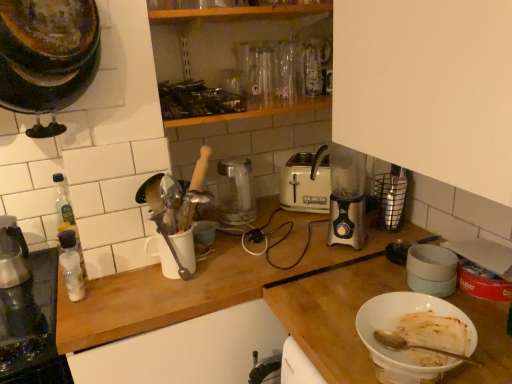
What is the approximate width of white plastic bottle at left, the first bottle from the back?

white plastic bottle at left, the first bottle from the back, is 2.09 inches in width.

Describe the element at coordinates (390, 198) in the screenshot. I see `satin silver blender at right, the first appliance viewed from the right` at that location.

How much space does matte white cup at center, marked as the second bowl in a right-to-left arrangement, occupy horizontally?

matte white cup at center, marked as the second bowl in a right-to-left arrangement, is 4.51 inches in width.

What do you see at coordinates (335, 315) in the screenshot? I see `white matte bowl at lower right, the 2th countertop when ordered from back to front` at bounding box center [335, 315].

Describe the element at coordinates (47, 53) in the screenshot. I see `rusty metal pot at upper left, arranged as the 1th kitchen appliance when viewed from the left` at that location.

Find the location of a particular element. This screenshot has width=512, height=384. rusty metal pot at upper left, arranged as the 1th kitchen appliance when viewed from the left is located at coordinates [47, 53].

What is the approximate height of clear plastic bottle at left, the 1th bottle viewed from the front?

A: It is 5.37 inches.

Find the location of a particular element. satin silver kettle at center, placed as the 1th kitchen appliance when sorted from back to front is located at coordinates (234, 191).

From a real-world perspective, starting from the white plastic toaster at center, which bottle is the 2nd one below it? Please provide its 2D coordinates.

[(71, 265)]

Is white plastic toaster at center positioned behind clear plastic bottle at left, the 1th bottle viewed from the front?

Yes.

In terms of width, does white matte bowl at lower right, the first bowl in the front-to-back sequence, look wider or thinner when compared to matte white cup at center, which appears as the first bowl when viewed from the left?

Considering their sizes, white matte bowl at lower right, the first bowl in the front-to-back sequence, looks slimmer than matte white cup at center, which appears as the first bowl when viewed from the left.

Who is more distant, white matte bowl at lower right, which is counted as the 2th bowl, starting from the back, or matte white cup at center, which appears as the first bowl when viewed from the left?

matte white cup at center, which appears as the first bowl when viewed from the left, is further from the camera.

Based on the photo, which is more to the left, white matte bowl at lower right, the first bowl in the front-to-back sequence, or matte white cup at center, which is counted as the second bowl, starting from the front?

matte white cup at center, which is counted as the second bowl, starting from the front, is more to the left.

From the image's perspective, is white plastic bottle at left, the first bottle from the back, above or below white plastic toaster at center?

Based on their image positions, white plastic bottle at left, the first bottle from the back, is located beneath white plastic toaster at center.

From a real-world perspective, is white plastic bottle at left, the first bottle from the back, physically above white plastic toaster at center?

No, from a real-world perspective, white plastic bottle at left, the first bottle from the back, is not over white plastic toaster at center

Who is smaller, white plastic bottle at left, the first bottle from the back, or white plastic toaster at center?

white plastic bottle at left, the first bottle from the back.

From the image's perspective, is rusty metal pot at upper left, acting as the 1th kitchen appliance starting from the front, on white plastic toaster at center?

Yes, from the image's perspective, rusty metal pot at upper left, acting as the 1th kitchen appliance starting from the front, is on top of white plastic toaster at center.

Which is correct: rusty metal pot at upper left, positioned as the third kitchen appliance in right-to-left order, is inside white plastic toaster at center, or outside of it?

rusty metal pot at upper left, positioned as the third kitchen appliance in right-to-left order, is located beyond the bounds of white plastic toaster at center.

From a real-world perspective, is rusty metal pot at upper left, acting as the 1th kitchen appliance starting from the front, positioned above or below white plastic toaster at center?

From a real-world perspective, rusty metal pot at upper left, acting as the 1th kitchen appliance starting from the front, is physically above white plastic toaster at center.

Are rusty metal pot at upper left, positioned as the third kitchen appliance in right-to-left order, and white plastic toaster at center far apart?

rusty metal pot at upper left, positioned as the third kitchen appliance in right-to-left order, is actually quite close to white plastic toaster at center.

From the image's perspective, between matte white cup at center, which appears as the first bowl when viewed from the left, and white matte bowl at lower right, which is counted as the 2th bowl, starting from the back, who is located below?

From the image's view, white matte bowl at lower right, which is counted as the 2th bowl, starting from the back, is below.

How different are the orientations of matte white cup at center, which is counted as the second bowl, starting from the front, and white matte bowl at lower right, the 2th bowl from the left, in degrees?

The angular difference between matte white cup at center, which is counted as the second bowl, starting from the front, and white matte bowl at lower right, the 2th bowl from the left, is 98.8 degrees.

Can we say matte white cup at center, marked as the second bowl in a right-to-left arrangement, lies outside white matte bowl at lower right, the first bowl in the front-to-back sequence?

Yes, matte white cup at center, marked as the second bowl in a right-to-left arrangement, is not within white matte bowl at lower right, the first bowl in the front-to-back sequence.

Is matte white cup at center, which appears as the first bowl when viewed from the left, positioned far away from white matte bowl at lower right, the 1th bowl positioned from the bottom?

That's not correct — matte white cup at center, which appears as the first bowl when viewed from the left, is a little close to white matte bowl at lower right, the 1th bowl positioned from the bottom.

Is rusty metal pot at upper left, acting as the 3th kitchen appliance starting from the back, facing towards metallic glass carafe at left?

No, rusty metal pot at upper left, acting as the 3th kitchen appliance starting from the back, does not turn towards metallic glass carafe at left.

Is rusty metal pot at upper left, positioned as the third kitchen appliance in right-to-left order, not within metallic glass carafe at left?

Absolutely, rusty metal pot at upper left, positioned as the third kitchen appliance in right-to-left order, is external to metallic glass carafe at left.

Is rusty metal pot at upper left, acting as the 1th kitchen appliance starting from the front, wider than metallic glass carafe at left?

In fact, rusty metal pot at upper left, acting as the 1th kitchen appliance starting from the front, might be narrower than metallic glass carafe at left.

Is satin silver blender at right, which appears as the second appliance when viewed from the left, located outside wooden at center, the second countertop when ordered from front to back?

satin silver blender at right, which appears as the second appliance when viewed from the left, is positioned outside wooden at center, the second countertop when ordered from front to back.

Based on the photo, is satin silver blender at right, the first appliance viewed from the right, facing away from wooden at center, the 1th countertop in the back-to-front sequence?

No.

This screenshot has width=512, height=384. I want to click on the 2nd countertop below when counting from the satin silver blender at right, which appears as the second appliance when viewed from the left (from the image's perspective), so click(x=232, y=305).

From the picture: From the image's perspective, does satin silver blender at right, which appears as the second appliance when viewed from the left, appear higher than wooden at center, the 1th countertop in the back-to-front sequence?

Indeed, from the image's perspective, satin silver blender at right, which appears as the second appliance when viewed from the left, is shown above wooden at center, the 1th countertop in the back-to-front sequence.

What are the coordinates of `bottle that is the 2nd object directly below the white plastic toaster at center (from a real-world perspective)` in the screenshot? It's located at (71, 265).

The width and height of the screenshot is (512, 384). I want to click on bowl above the white matte bowl at lower right, the first bowl in the front-to-back sequence (from the image's perspective), so click(205, 232).

Which object lies further to the anchor point white plastic bottle at left, the 2th bottle viewed from the front, rusty metal pot at upper left, arranged as the 1th kitchen appliance when viewed from the left, or satin silver kettle at center, the 3th kitchen appliance viewed from the front?

satin silver kettle at center, the 3th kitchen appliance viewed from the front, is further to white plastic bottle at left, the 2th bottle viewed from the front.

Looking at the image, which one is located closer to white matte bowl at lower right, the 1th bowl positioned from the bottom, silver metallic blender at center, arranged as the 2th kitchen appliance when viewed from the front, or clear plastic bottle at left, the second bottle in the back-to-front sequence?

silver metallic blender at center, arranged as the 2th kitchen appliance when viewed from the front, is closer to white matte bowl at lower right, the 1th bowl positioned from the bottom.

From the image, which object appears to be farther from rusty metal pot at upper left, acting as the 1th kitchen appliance starting from the front, wooden at center, the 1th countertop in the back-to-front sequence, or satin silver kettle at center, the 3th kitchen appliance viewed from the front?

Based on the image, satin silver kettle at center, the 3th kitchen appliance viewed from the front, appears to be further to rusty metal pot at upper left, acting as the 1th kitchen appliance starting from the front.

Which object lies further to the anchor point wooden at center, the second countertop when ordered from front to back, silver metallic blender at center, the second kitchen appliance from the back, or metallic glass carafe at left?

metallic glass carafe at left.

Based on their spatial positions, is rusty metal pot at upper left, acting as the 3th kitchen appliance starting from the back, or white plastic toaster at center closer to satin silver kettle at center, the 2th kitchen appliance from the left?

white plastic toaster at center is closer to satin silver kettle at center, the 2th kitchen appliance from the left.

Which object lies further to the anchor point white plastic bottle at left, the first bottle from the back, satin silver blender at right, the first appliance viewed from the right, or wooden at center, the 1th countertop in the back-to-front sequence?

satin silver blender at right, the first appliance viewed from the right.

Which object lies nearer to the anchor point clear plastic bottle at left, the 1th bottle viewed from the front, metallic glass carafe at left or satin silver kettle at center, placed as the 1th kitchen appliance when sorted from back to front?

metallic glass carafe at left lies closer to clear plastic bottle at left, the 1th bottle viewed from the front, than the other object.

Looking at the image, which one is located further to matte white cup at center, acting as the first bowl starting from the top, white plastic bottle at left, the first bottle from the back, or metallic glass carafe at left?

metallic glass carafe at left.

You are a GUI agent. You are given a task and a screenshot of the screen. Output one action in this format:
    pyautogui.click(x=<x>, y=<y>)
    Task: Click on the bowl located between wooden at center, the 1th countertop in the back-to-front sequence, and white matte bowl at lower right, the 2th countertop when ordered from back to front, in the left-right direction
    The height and width of the screenshot is (384, 512).
    Given the screenshot: What is the action you would take?
    pyautogui.click(x=415, y=336)

Identify the location of bowl located between brushed metal coffee maker at left, the 2th appliance positioned from the right, and wooden at center, the second countertop when ordered from front to back, in the left-right direction. (205, 232).

The height and width of the screenshot is (384, 512). Find the location of `bottle between white plastic bottle at left, the first bottle from the back, and matte white cup at center, acting as the first bowl starting from the top, in the horizontal direction`. bottle between white plastic bottle at left, the first bottle from the back, and matte white cup at center, acting as the first bowl starting from the top, in the horizontal direction is located at coordinates (71, 265).

This screenshot has width=512, height=384. What are the coordinates of `bottle situated between white plastic bottle at left, the first bottle from the back, and silver metallic blender at center, the second kitchen appliance from the back, from left to right` in the screenshot? It's located at (71, 265).